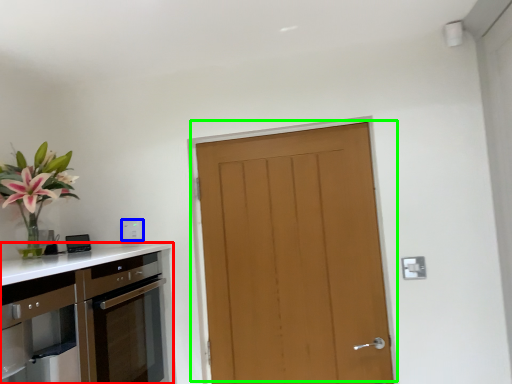
Question: Which object is the farthest from cabinetry (highlighted by a red box)? Choose among these: electric outlet (highlighted by a blue box) or door (highlighted by a green box).

Choices:
 (A) electric outlet
 (B) door

Answer: (B)